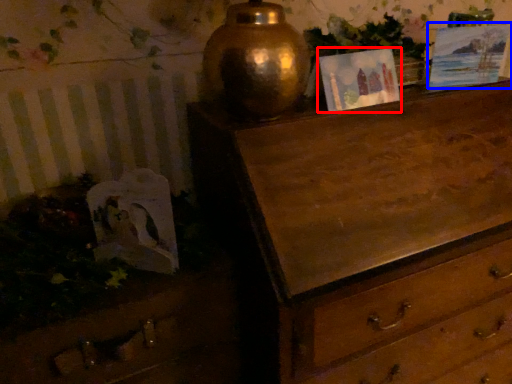
Question: Which point is further to the camera, picture frame (highlighted by a red box) or picture frame (highlighted by a blue box)?

Choices:
 (A) picture frame
 (B) picture frame

Answer: (B)